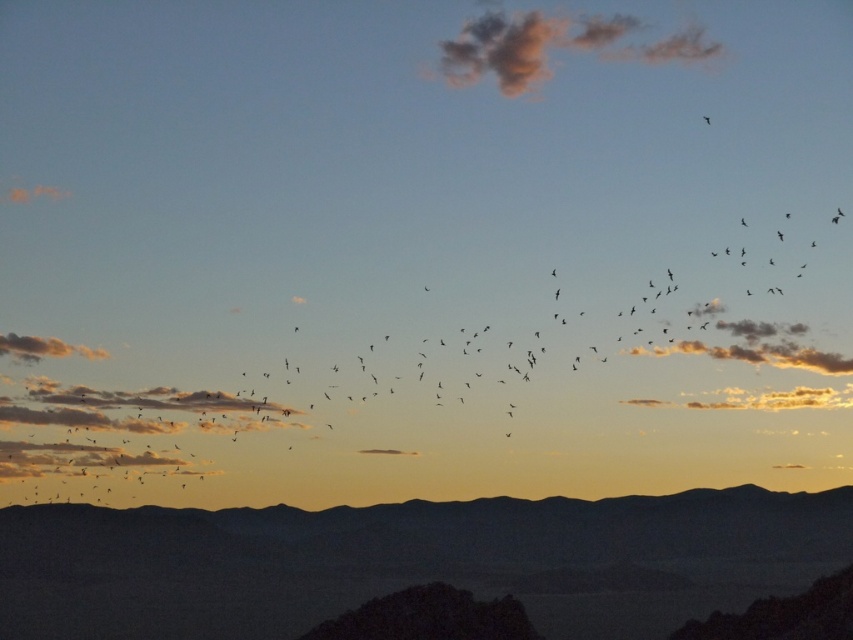
From the picture: Does silhouetted rock at lower center appear under soft pink cotton cloud at upper center?

Yes, silhouetted rock at lower center is below soft pink cotton cloud at upper center.

Who is higher up, silhouetted rock at lower center or soft pink cotton cloud at upper center?

soft pink cotton cloud at upper center is higher up.

Who is more distant from viewer, (x=579, y=536) or (x=485, y=49)?

Point (x=485, y=49)

What are the coordinates of `silhouetted rock at lower center` in the screenshot? It's located at (410, 561).

Who is more distant from viewer, [73,570] or [747,348]?

The point [747,348] is behind.

Which is in front, point (107, 552) or point (633, 349)?

Positioned in front is point (107, 552).

Between point (614, 611) and point (682, 342), which one is positioned in front?

Point (614, 611) is in front.

Where is `silhouetted rock at lower center`? The image size is (853, 640). silhouetted rock at lower center is located at coordinates (410, 561).

Between soft pink cotton cloud at upper center and dark gray textured cloud at right, which one is positioned higher?

soft pink cotton cloud at upper center is higher up.

Image resolution: width=853 pixels, height=640 pixels. Describe the element at coordinates (553, 45) in the screenshot. I see `soft pink cotton cloud at upper center` at that location.

Locate an element on the screen. The image size is (853, 640). soft pink cotton cloud at upper center is located at coordinates (553, 45).